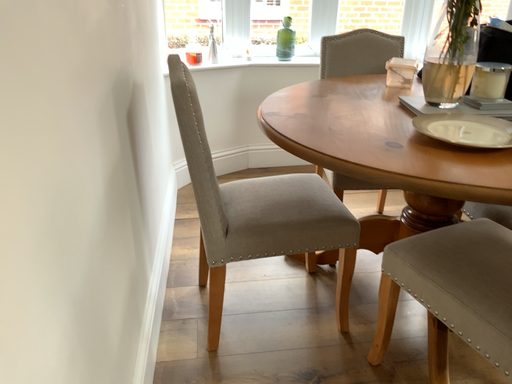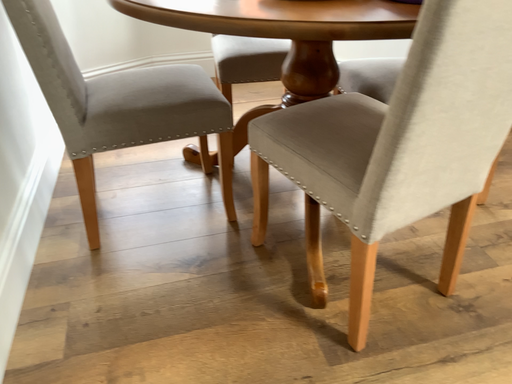
Question: Which way did the camera rotate in the video?

Choices:
 (A) rotated upward
 (B) rotated downward

Answer: (B)